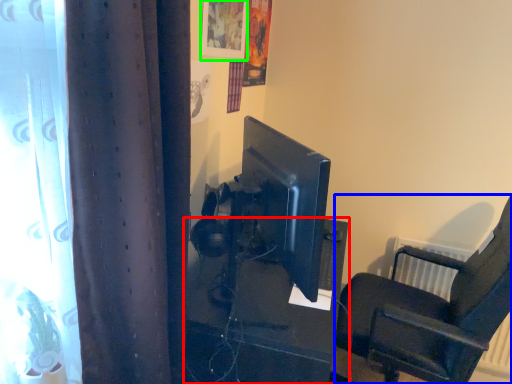
Question: Based on their relative distances, which object is nearer to furniture (highlighted by a red box)? Choose from chair (highlighted by a blue box) and picture frame (highlighted by a green box).

Choices:
 (A) chair
 (B) picture frame

Answer: (A)